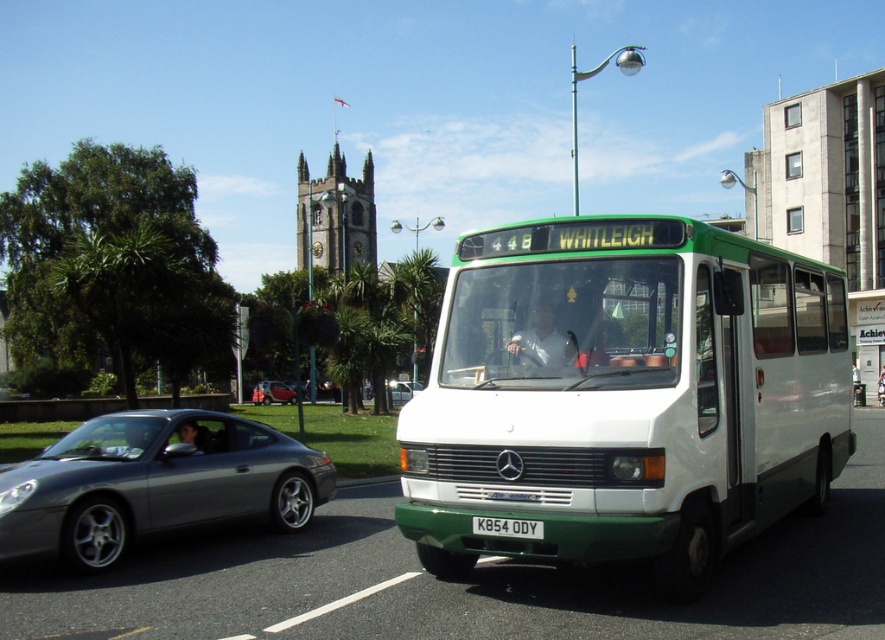
You are standing on the sidewalk and see a point marked at coordinates (624, 396). Which object is this point located on?

The point is located on the white matte bus at center.

You are a pedestrian standing on the sidewalk. You see the white matte bus at center and the white plastic license plate at center. Which object is closer to you?

The white matte bus at center is closer to you because it is in front of the white plastic license plate at center.

You are a passenger waiting at the green plastic bus stop at center. You see the white matte bus at center approaching. Based on their sizes, which object will appear closer to you as it moves forward?

The white matte bus at center will appear closer because it is smaller than the green plastic bus stop at center, so as it moves forward, its apparent size will increase more rapidly, making it seem closer.